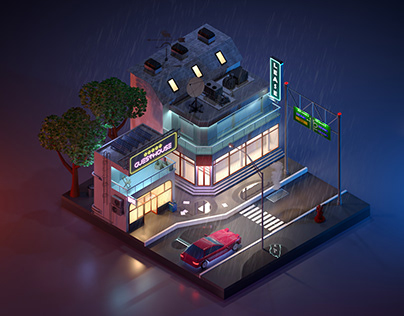
Where is `windows`? windows is located at coordinates (240, 163), (230, 168), (259, 151), (263, 145), (184, 169), (166, 199), (134, 215).